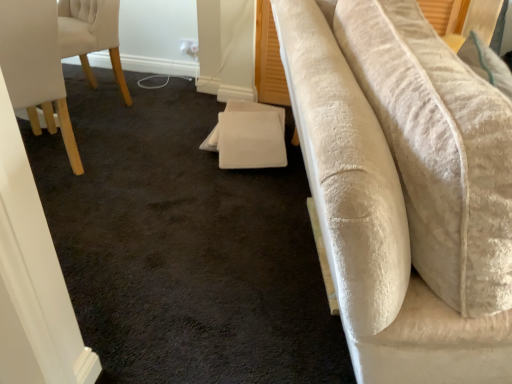
This screenshot has height=384, width=512. Describe the element at coordinates (36, 66) in the screenshot. I see `white leather chair at left` at that location.

At what (x,y) coordinates should I click in order to perform the action: click on white leather chair at left. Please return your answer as a coordinate pair (x, y). This screenshot has height=384, width=512. Looking at the image, I should click on (36, 66).

This screenshot has width=512, height=384. I want to click on white leather chair at left, so click(36, 66).